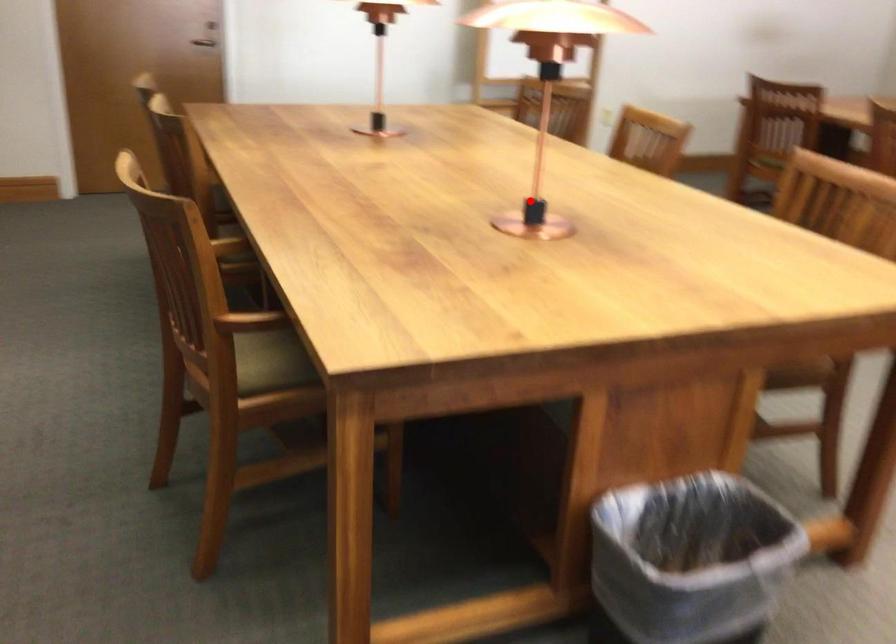
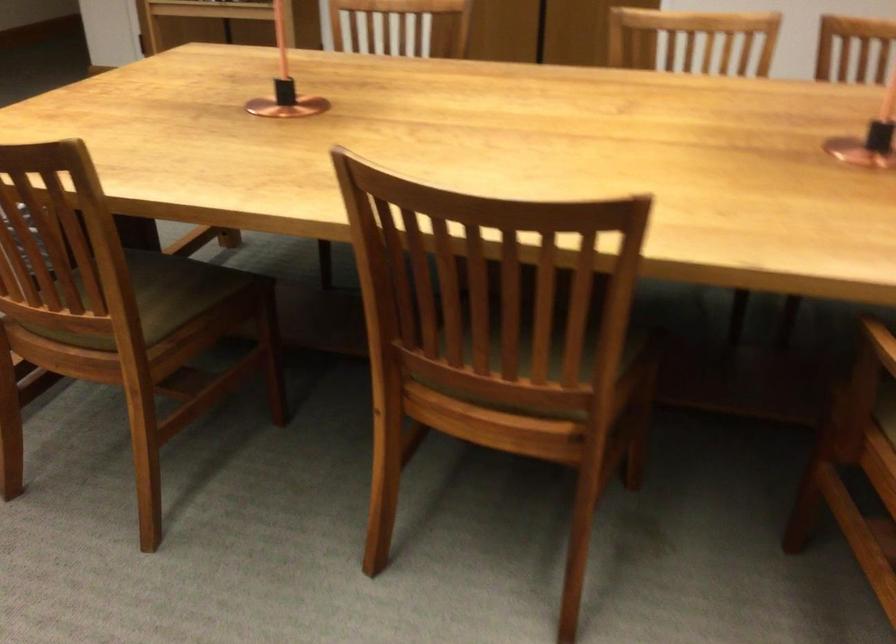
Locate, in the second image, the point that corresponds to the highlighted location in the first image.

(285, 84)